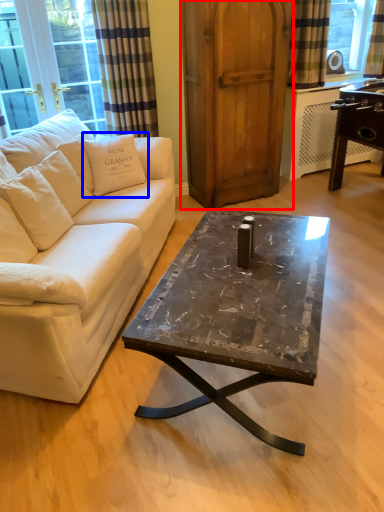
Question: Which object appears closest to the camera in this image, armoire (highlighted by a red box) or pillow (highlighted by a blue box)?

Choices:
 (A) armoire
 (B) pillow

Answer: (B)